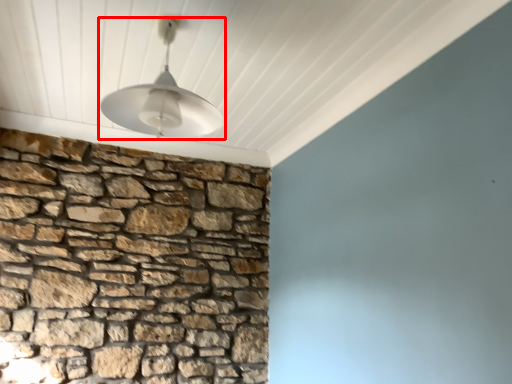
Question: In this image, where is lamp (annotated by the red box) located relative to brickwork?

Choices:
 (A) right
 (B) left

Answer: (A)